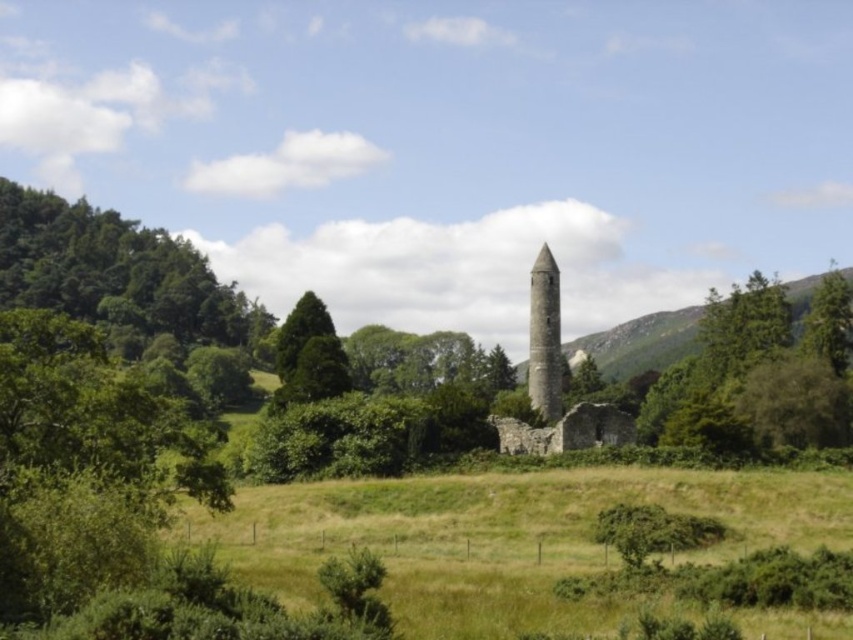
What are the coordinates of the green grassy field at center?

The coordinates of the green grassy field at center are at point (502, 538).

You are standing at the point marked as point (544, 337) in the image. What object is directly in front of you?

The green stone obelisk at center is directly in front of you at point (544, 337).